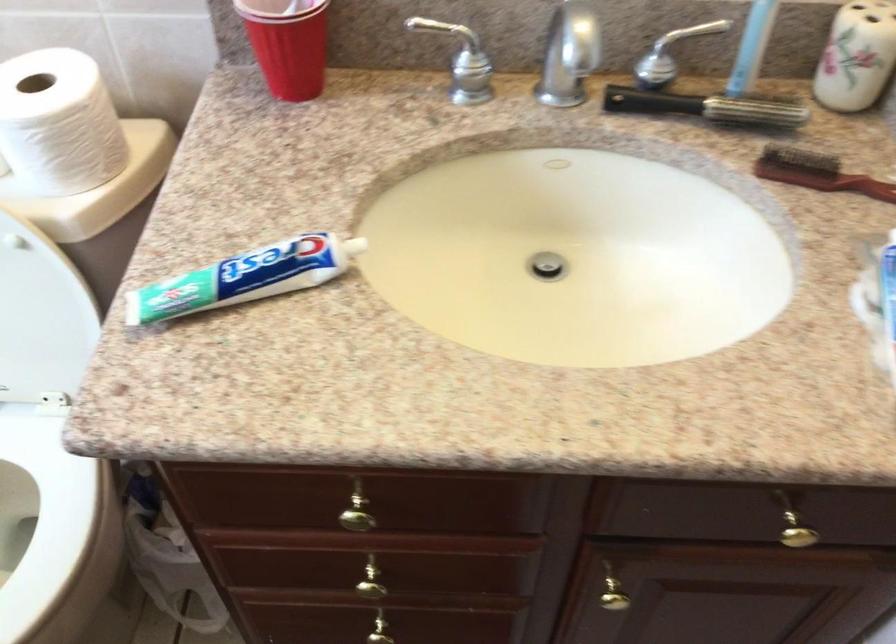
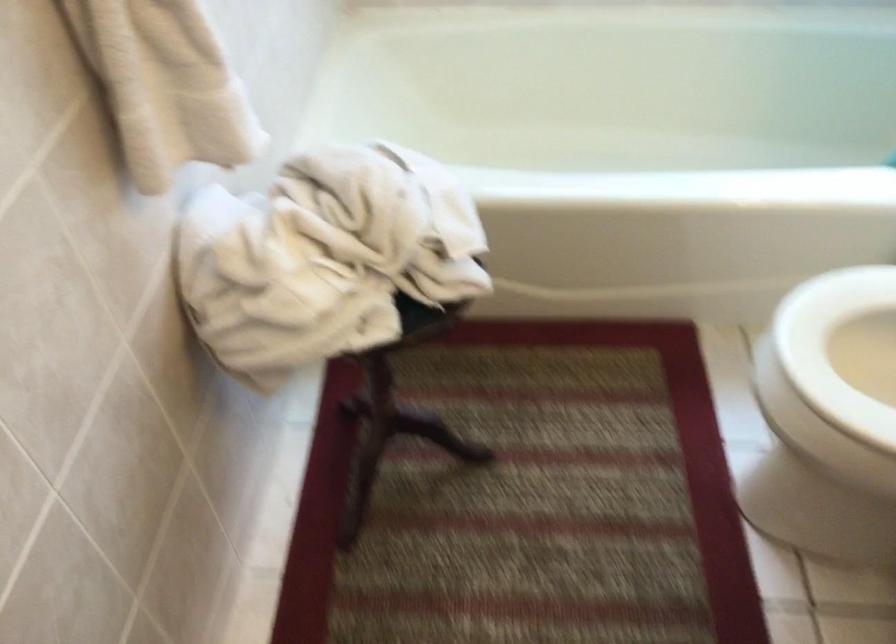
How did the camera likely rotate?

The camera rotated toward left-down.